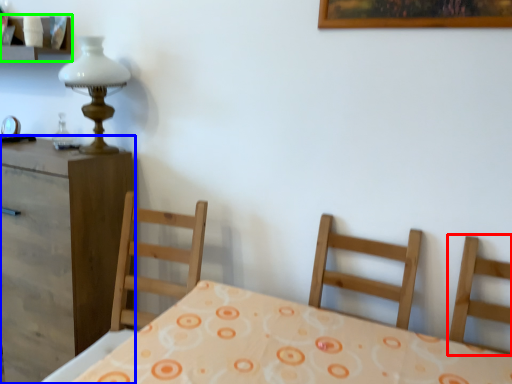
Question: Estimate the real-world distances between objects in this image. Which object is farther from chair (highlighted by a red box), nightstand (highlighted by a blue box) or shelf (highlighted by a green box)?

Choices:
 (A) nightstand
 (B) shelf

Answer: (B)